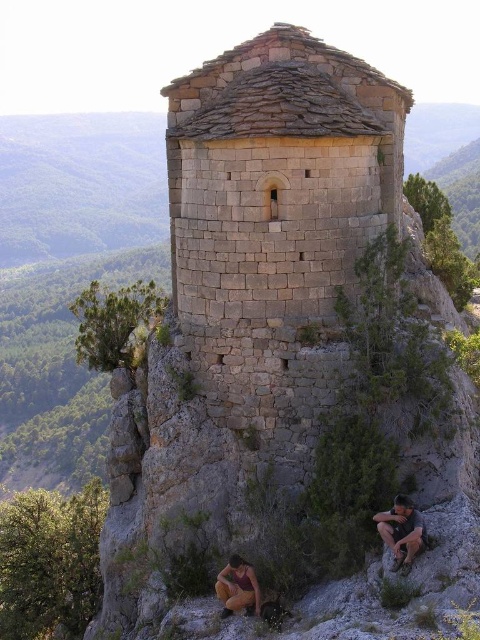
You are standing at the base of the ancient stone structure and notice two items near the rocky outcrop. The matte gray rock at lower right and the orange fabric pants at lower center. Which item is closer to you?

The matte gray rock at lower right is closer to you since it has a smaller size compared to the orange fabric pants at lower center, which implies it is farther away.

You are standing at the base of the ancient stone structure and notice two items near your feet. You see the matte gray rock at lower right and the orange fabric pants at lower center. Which object is narrower in width?

The matte gray rock at lower right is narrower in width than the orange fabric pants at lower center.